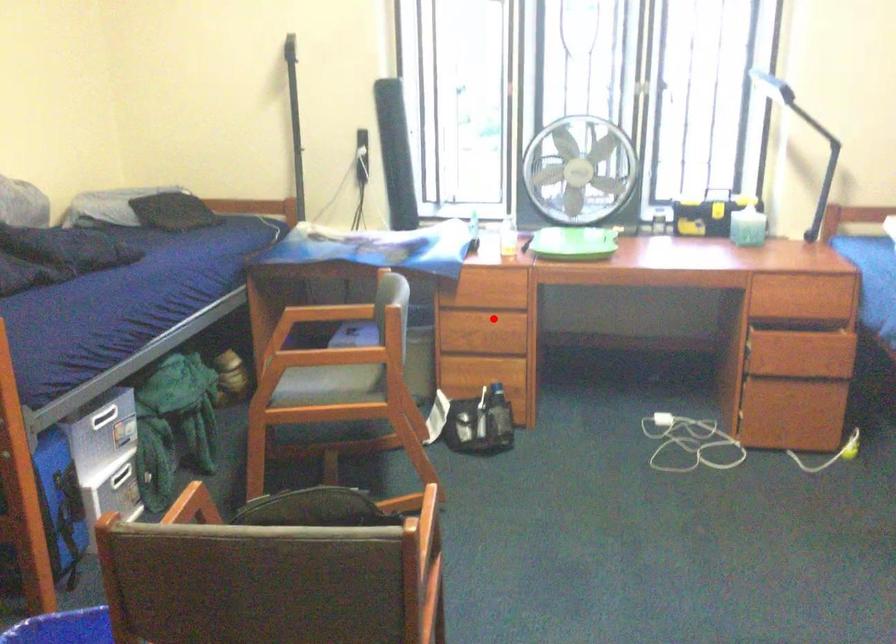
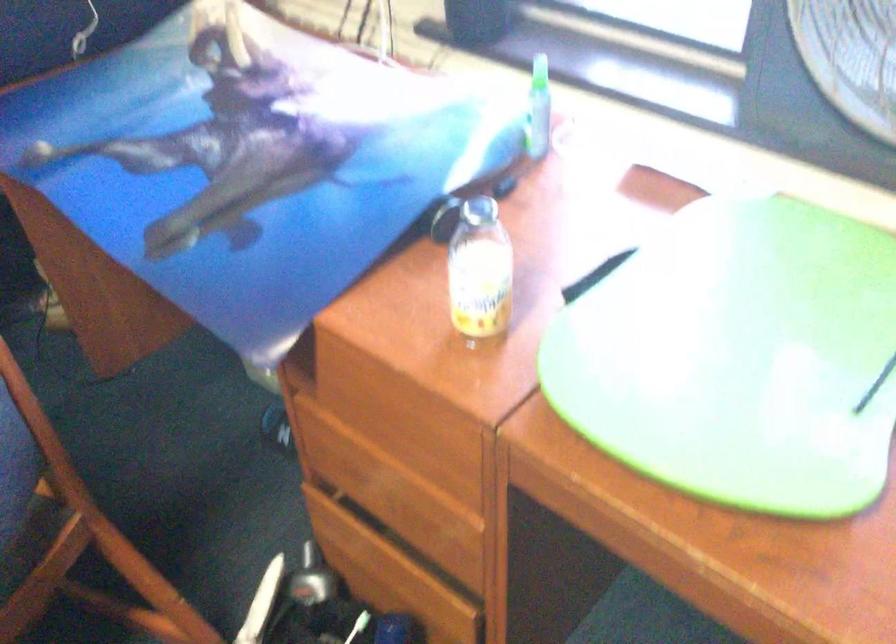
Locate, in the second image, the point that corresponds to the highlighted location in the first image.

(408, 485)